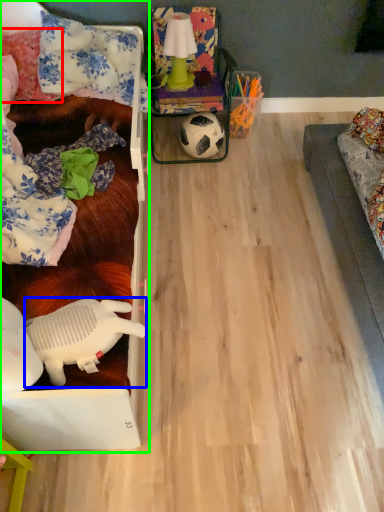
Question: Which is farther away from pillow (highlighted by a red box)? toy (highlighted by a blue box) or furniture (highlighted by a green box)?

Choices:
 (A) toy
 (B) furniture

Answer: (A)